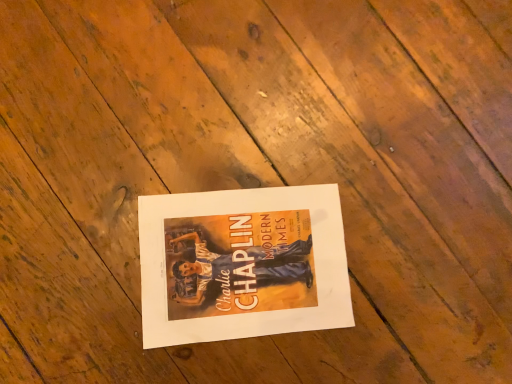
Image resolution: width=512 pixels, height=384 pixels. What are the coordinates of `vacant region in front of matte paper poster at center` in the screenshot? It's located at (134, 345).